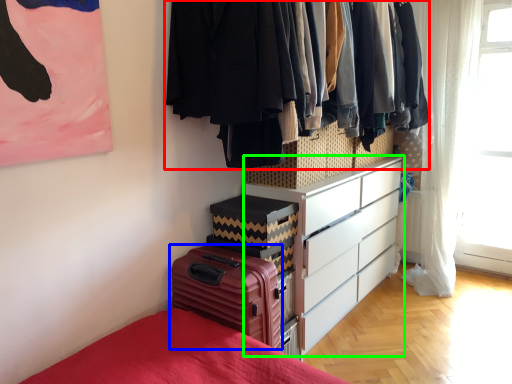
Question: Which object is the farthest from closet (highlighted by a red box)? Choose among these: suitcase (highlighted by a blue box) or chest of drawers (highlighted by a green box).

Choices:
 (A) suitcase
 (B) chest of drawers

Answer: (B)